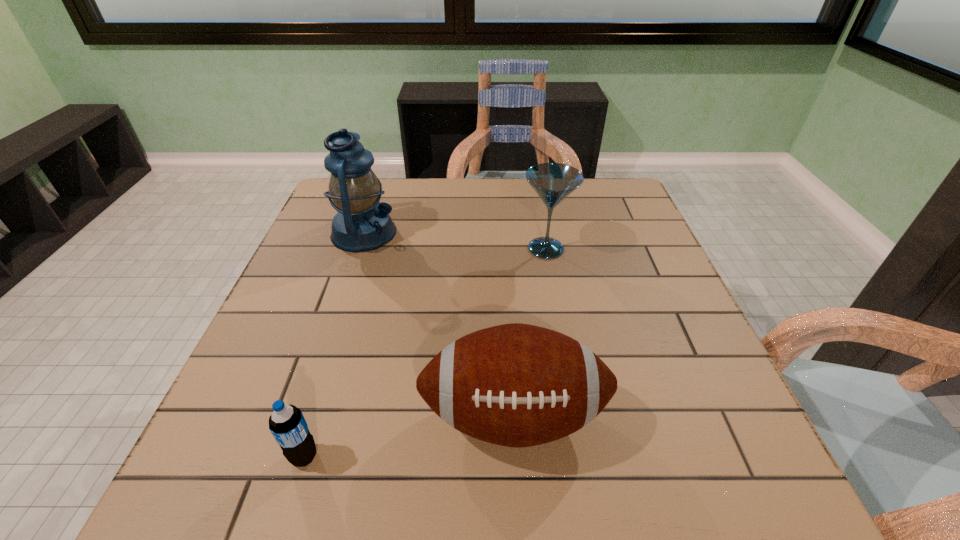
Find the location of a particular element. lantern at the left edge is located at coordinates (362, 223).

This screenshot has width=960, height=540. I want to click on soda bottle that is at the left edge, so click(x=287, y=424).

Identify the location of object present at the far left corner. (362, 223).

What are the coordinates of `object present at the near left corner` in the screenshot? It's located at (287, 424).

You are a GUI agent. You are given a task and a screenshot of the screen. Output one action in this format:
    pyautogui.click(x=<x>, y=<y>)
    Task: Click on the vacant space at the far edge
    Image resolution: width=960 pixels, height=540 pixels.
    Given the screenshot: What is the action you would take?
    [x=557, y=214]

Where is `free space at the near edge of the desktop`? The width and height of the screenshot is (960, 540). free space at the near edge of the desktop is located at coordinates (428, 507).

Find the location of a particular element. This screenshot has height=540, width=960. vacant space at the right edge of the desktop is located at coordinates (619, 296).

Image resolution: width=960 pixels, height=540 pixels. Find the location of `vacant space at the near left corner of the desktop`. vacant space at the near left corner of the desktop is located at coordinates (259, 500).

Find the location of a particular element. The height and width of the screenshot is (540, 960). vacant area that lies between the football and the shortest object is located at coordinates (409, 437).

This screenshot has height=540, width=960. I want to click on vacant point located between the football and the tallest object, so click(x=439, y=325).